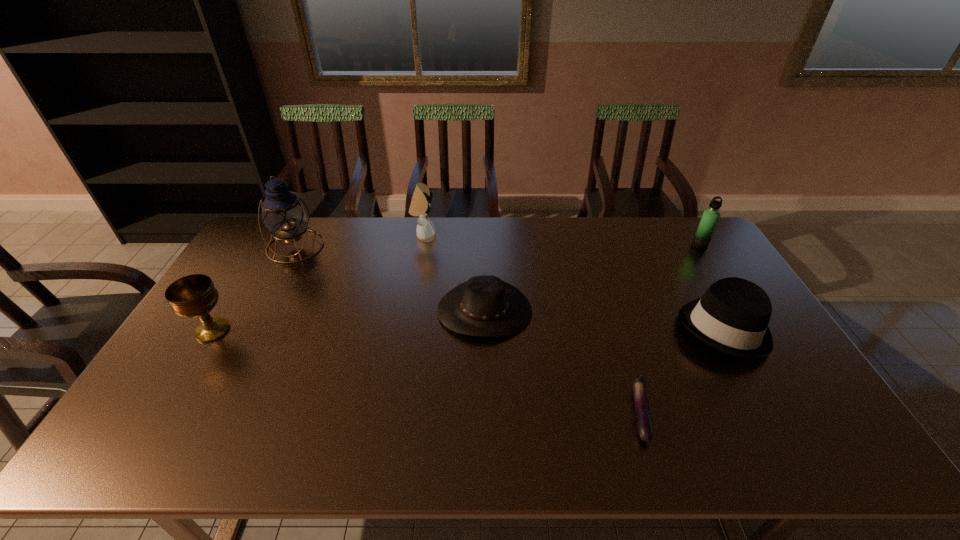
The image size is (960, 540). In order to click on lantern in this screenshot , I will do `click(284, 214)`.

You are a GUI agent. You are given a task and a screenshot of the screen. Output one action in this format:
    pyautogui.click(x=<x>, y=<y>)
    Task: Click on the doll
    This screenshot has width=960, height=540.
    Given the screenshot: What is the action you would take?
    pyautogui.click(x=420, y=205)

Identify the location of thermos bottle. The width and height of the screenshot is (960, 540). (710, 217).

I want to click on chalice, so click(194, 296).

Where is `fedora`? The height and width of the screenshot is (540, 960). fedora is located at coordinates (732, 316).

Locate an element on the screen. The image size is (960, 540). the fourth object from left to right is located at coordinates (485, 306).

This screenshot has height=540, width=960. In order to click on the second shortest object in this screenshot , I will do `click(485, 306)`.

The image size is (960, 540). Identify the location of the shortest object. (643, 418).

This screenshot has height=540, width=960. In order to click on the fifth object from left to right in this screenshot , I will do `click(643, 418)`.

This screenshot has height=540, width=960. Find the location of `vacant area located 0.310m on the front-facing side of the lantern`. vacant area located 0.310m on the front-facing side of the lantern is located at coordinates (252, 331).